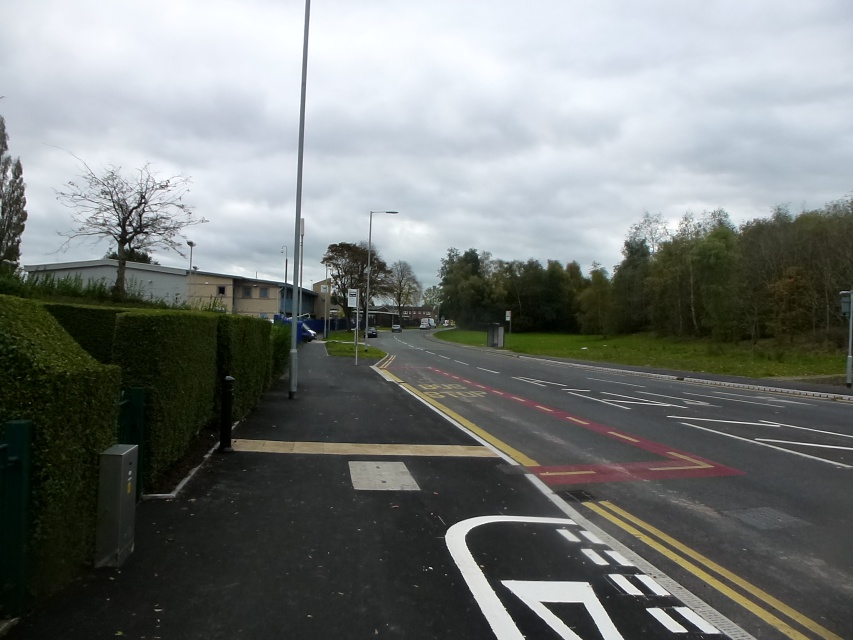
You are standing at the bus stop in the image. Looking around, you notice a point marked at coordinates (114, 403). Which object does this point correspond to?

The point at coordinates (114, 403) corresponds to the green leafy hedge at left.

You are standing at the point with coordinates point [357,289] and want to walk to the point with coordinates point [773,284]. Based on the scene description, which direction should you face to move towards your destination?

You should face forward because point [773,284] is in front of point [357,289].